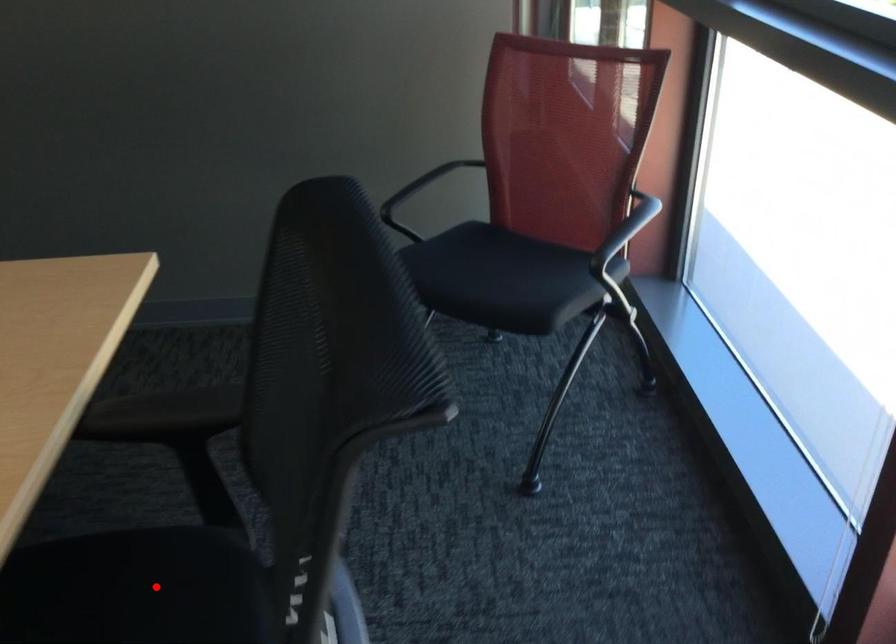
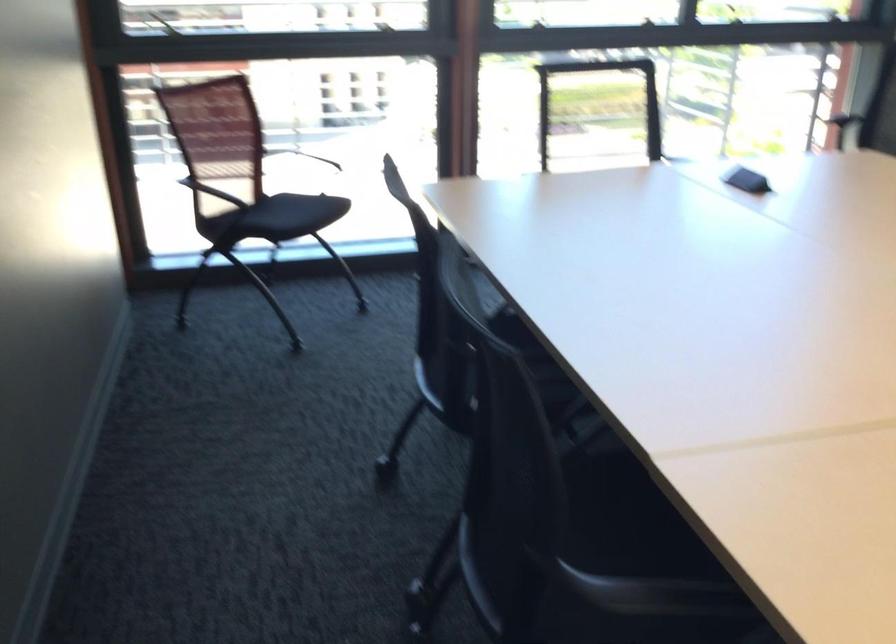
Question: I am providing you with two images of the same scene from different viewpoints. A red point is marked on the first image. Can you still see the location of the red point in image 2?

Choices:
 (A) Yes
 (B) No

Answer: (B)